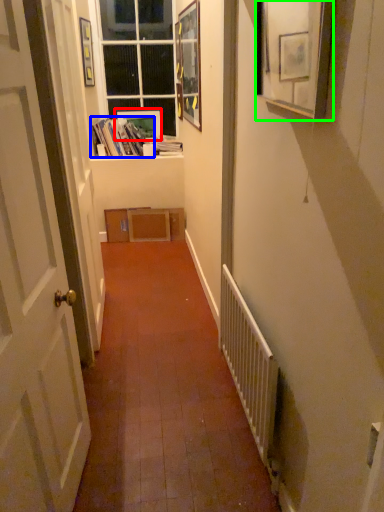
Question: Which object is positioned farthest from picture frame (highlighted by a red box)? Select from book (highlighted by a blue box) and picture frame (highlighted by a green box).

Choices:
 (A) book
 (B) picture frame

Answer: (B)